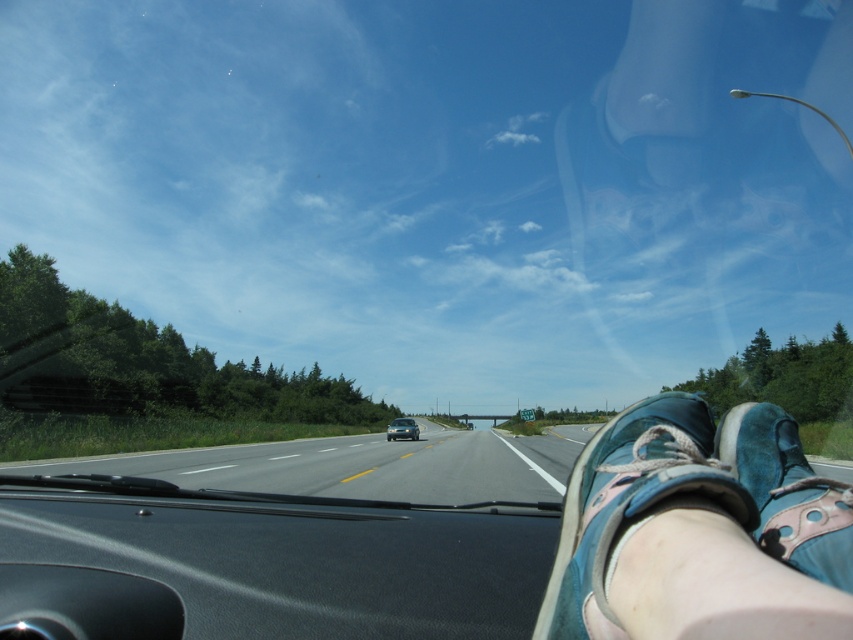
Question: Which of the following is the farthest from the observer?

Choices:
 (A) suede blue shoe at lower right
 (B) metallic silver sedan at center

Answer: (B)

Question: Can you confirm if blue suede shoe at lower right is positioned to the right of suede blue shoe at lower right?

Choices:
 (A) yes
 (B) no

Answer: (B)

Question: Does asphalt road at center appear under suede blue shoe at lower right?

Choices:
 (A) yes
 (B) no

Answer: (A)

Question: Which of these objects is positioned closest to the asphalt road at center?

Choices:
 (A) metallic silver sedan at center
 (B) suede blue shoe at lower right
 (C) blue suede shoe at lower right

Answer: (A)

Question: Among these objects, which one is farthest from the camera?

Choices:
 (A) blue suede shoe at lower right
 (B) metallic silver sedan at center
 (C) suede blue shoe at lower right

Answer: (B)

Question: In this image, where is asphalt road at center located relative to suede blue shoe at lower right?

Choices:
 (A) below
 (B) above

Answer: (A)